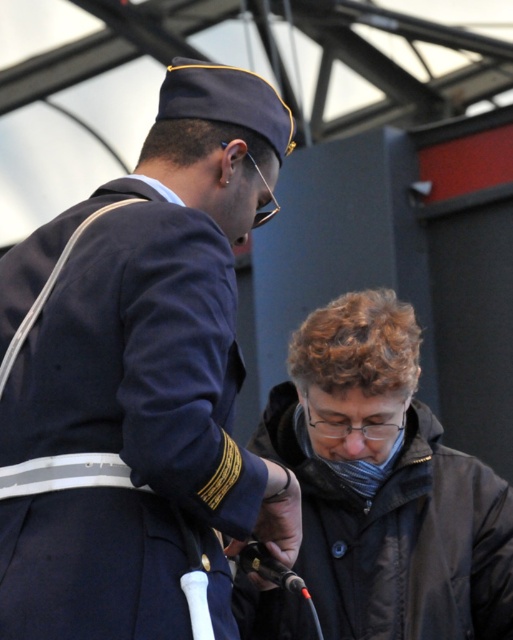
You are observing a ceremony where two people are under a canopy. You see the navy blue uniform at upper left and the black matte jacket at lower right. Which person is standing higher in the image?

The navy blue uniform at upper left is taller than the black matte jacket at lower right, so the person in the navy blue uniform at upper left is standing higher in the image.

You are standing in the scene and need to hand a document to both individuals. Since you can only reach up to shoulder height, can you place the document on the ground between the navy blue uniform at upper left and the black matte jacket at lower right without needing to climb?

The navy blue uniform at upper left is located above the black matte jacket at lower right, so placing the document on the ground between them would be possible since the lower position of the black matte jacket at lower right means there is space between their positions at ground level.